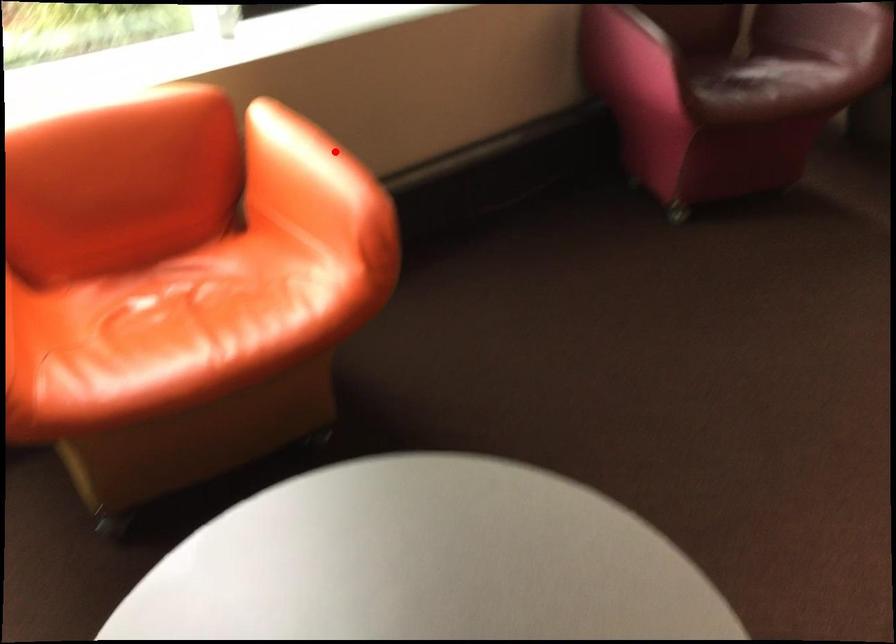
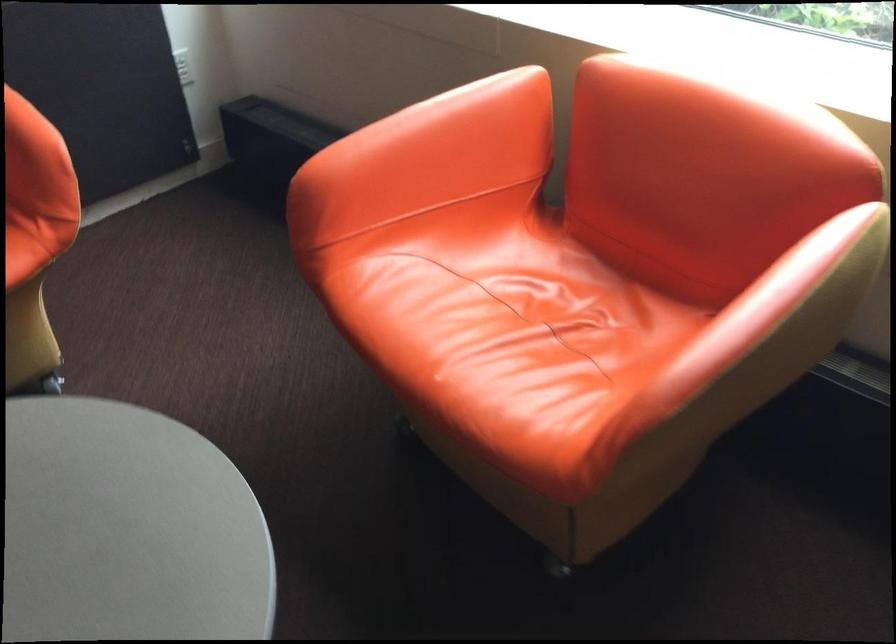
Question: I am providing you with two images of the same scene from different viewpoints. In image1, a red point is highlighted. Considering the same 3D point in image2, which of the following is correct?

Choices:
 (A) It is closer
 (B) It is farther

Answer: (A)